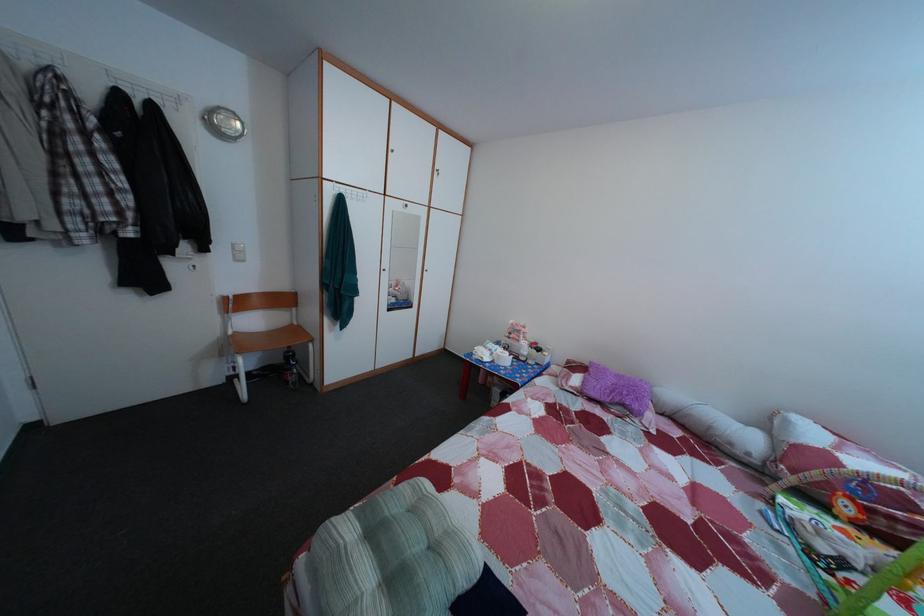
Image resolution: width=924 pixels, height=616 pixels. Identify the location of white light switch. (237, 252).